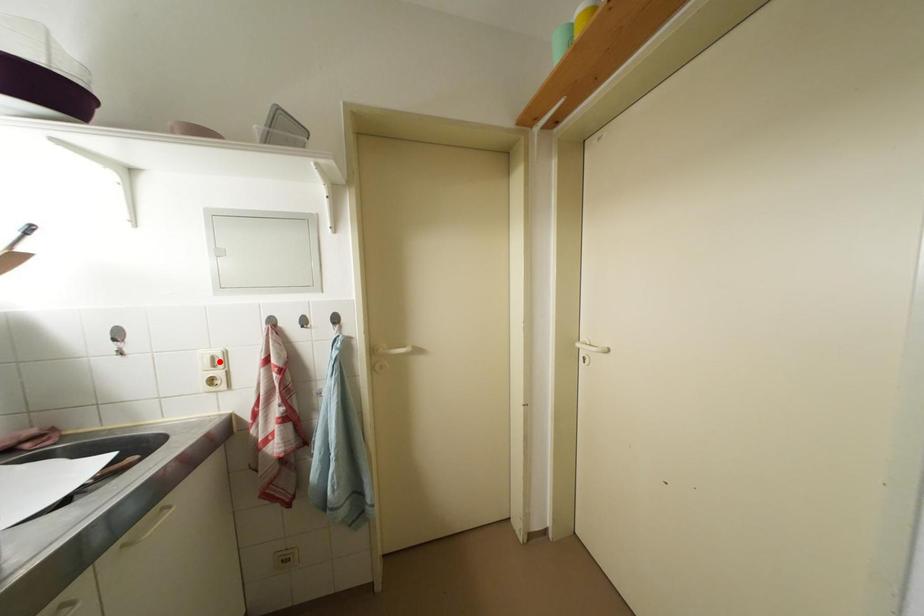
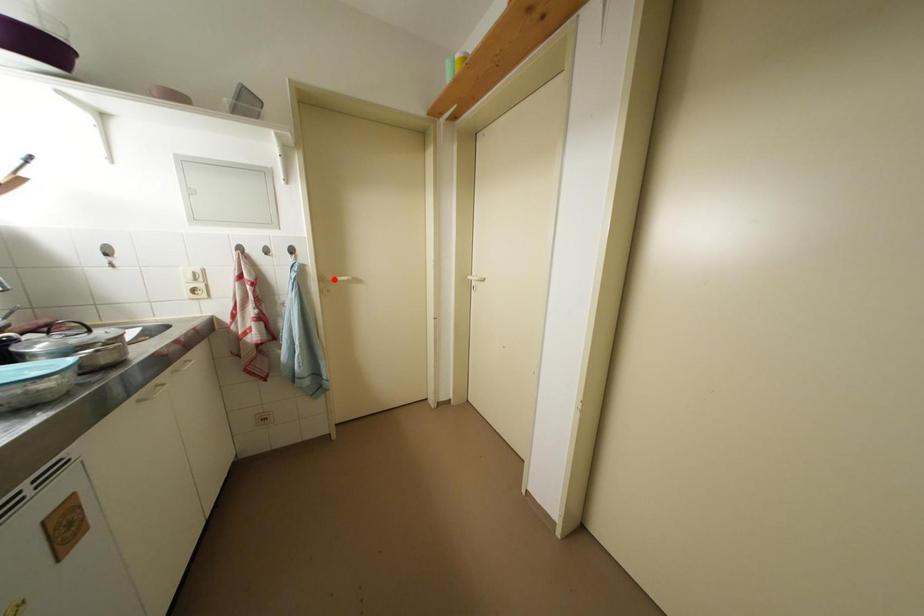
I am providing you with two images of the same scene from different viewpoints. A red point is marked on the first image and another point is marked on the second image. Do the highlighted points in image1 and image2 indicate the same real-world spot?

No